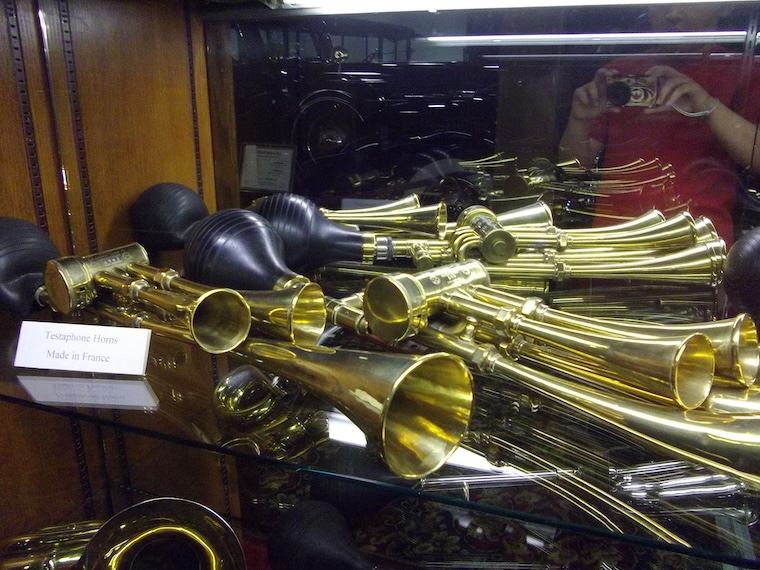
This screenshot has width=760, height=570. Identify the location of table. (192, 389).